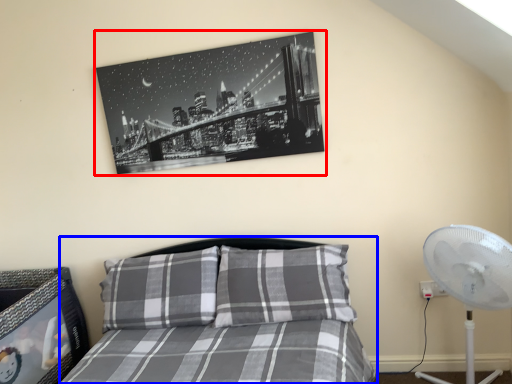
Question: Which object appears closest to the camera in this image, picture frame (highlighted by a red box) or bed (highlighted by a blue box)?

Choices:
 (A) picture frame
 (B) bed

Answer: (B)